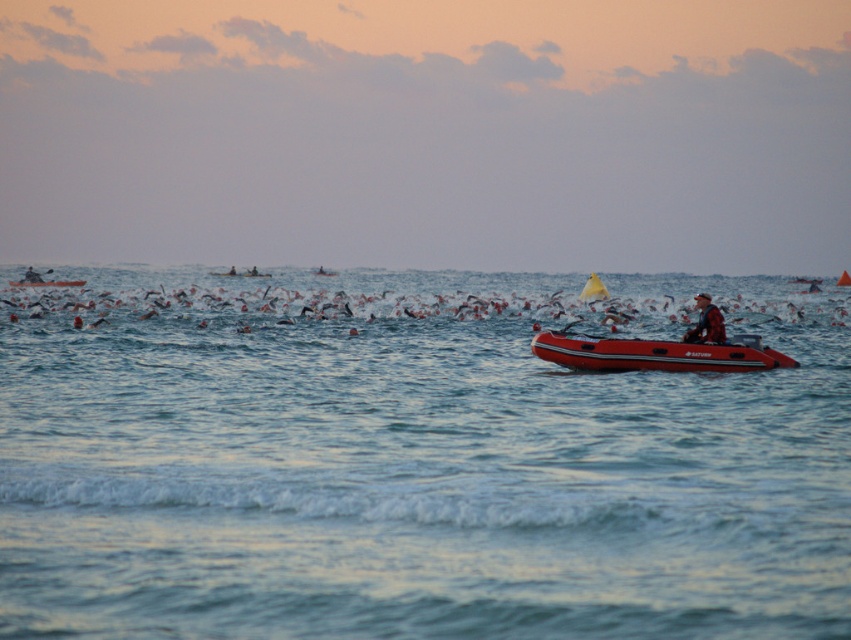
You are a participant in the swimming event and want to know if you can see the rubber boat at left from the blue water at center. Based on their heights, can you see it?

The blue water at center has a greater height compared to rubber boat at left, so the water might block the view of the rubber boat at left.

You are a participant in the swimming event and notice the rubberized red inflatable boat at right and the red life jacket at center. Which object is nearer to you?

The rubberized red inflatable boat at right is closer to the viewer than the red life jacket at center.